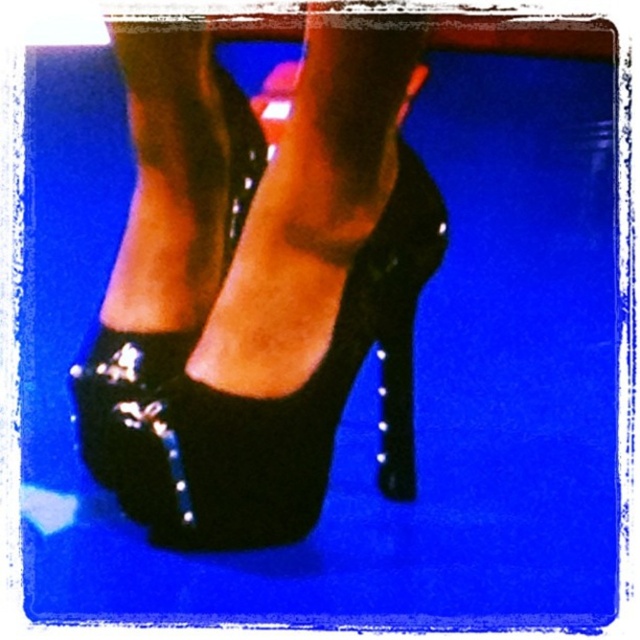
Which is below, shiny black high heels at center or shiny black high-heeled shoe at center?

shiny black high-heeled shoe at center is lower down.

Can you confirm if shiny black high heels at center is taller than shiny black high-heeled shoe at center?

Correct, shiny black high heels at center is much taller as shiny black high-heeled shoe at center.

The image size is (640, 640). What are the coordinates of `shiny black high heels at center` in the screenshot? It's located at (259, 284).

The image size is (640, 640). In order to click on shiny black high heels at center in this screenshot , I will do `click(259, 284)`.